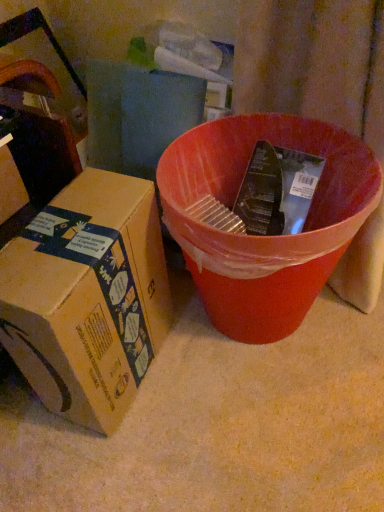
Question: From a real-world perspective, relative to brown cardboard box at left, arranged as the 2th box when viewed from the left, is brown cardboard box at left, arranged as the 2th box when viewed from the right, vertically above or below?

Choices:
 (A) above
 (B) below

Answer: (A)

Question: Which is correct: brown cardboard box at left, arranged as the 2th box when viewed from the right, is inside brown cardboard box at left, arranged as the 2th box when viewed from the left, or outside of it?

Choices:
 (A) outside
 (B) inside

Answer: (A)

Question: Which object is positioned closest to the matte plastic bucket at center?

Choices:
 (A) brown cardboard box at left, positioned as the first box in left-to-right order
 (B) brown cardboard box at left, which is the 1th box from right to left

Answer: (B)

Question: Which is farther from the matte plastic bucket at center?

Choices:
 (A) brown cardboard box at left, arranged as the 2th box when viewed from the right
 (B) brown cardboard box at left, arranged as the 2th box when viewed from the left

Answer: (A)